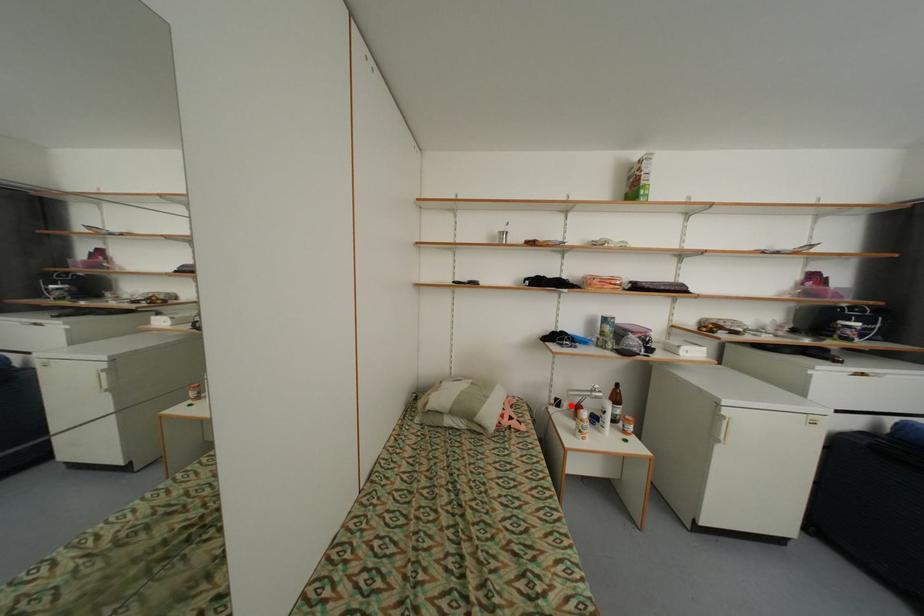
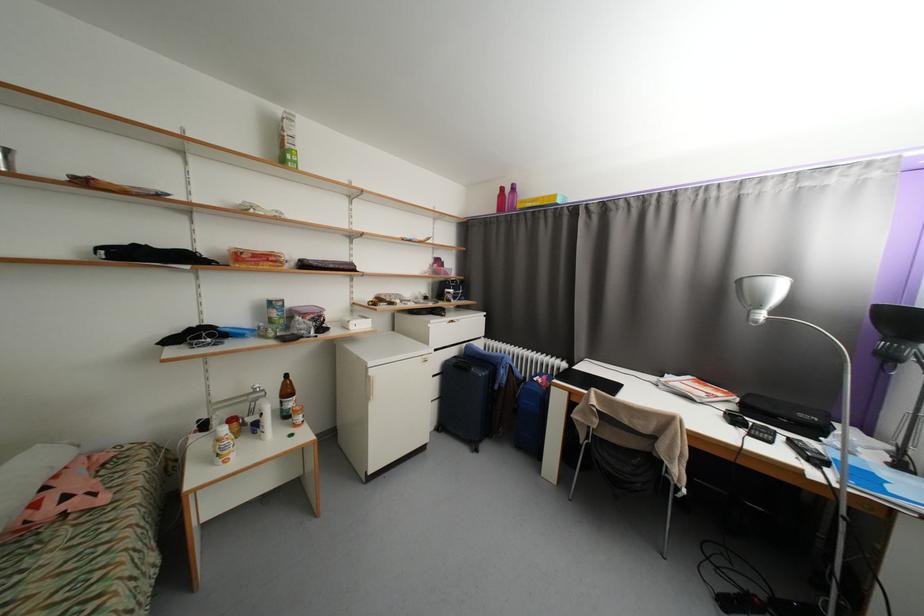
Question: I am providing you with two images of the same scene from different viewpoints. A red point is shown in image1. For the corresponding object point in image2, is it positioned nearer or farther from the camera?

Choices:
 (A) Nearer
 (B) Farther

Answer: (B)